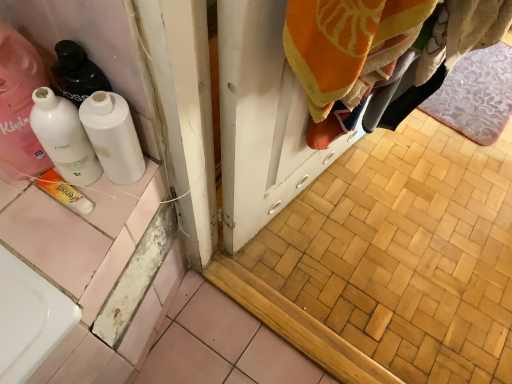
Question: Does yellow matte tube at lower left have a greater height compared to white glossy bottle at left, the first bottle positioned from the left?

Choices:
 (A) yes
 (B) no

Answer: (B)

Question: From a real-world perspective, does yellow matte tube at lower left sit lower than white glossy bottle at left, the first bottle positioned from the left?

Choices:
 (A) no
 (B) yes

Answer: (B)

Question: Considering the relative sizes of yellow matte tube at lower left and white glossy bottle at left, which is the second bottle in right-to-left order, in the image provided, is yellow matte tube at lower left bigger than white glossy bottle at left, which is the second bottle in right-to-left order,?

Choices:
 (A) yes
 (B) no

Answer: (B)

Question: Is the position of yellow matte tube at lower left more distant than that of white glossy bottle at left, which is the second bottle in right-to-left order?

Choices:
 (A) no
 (B) yes

Answer: (B)

Question: Considering the relative sizes of yellow matte tube at lower left and white glossy bottle at left, which is the second bottle in right-to-left order, in the image provided, is yellow matte tube at lower left thinner than white glossy bottle at left, which is the second bottle in right-to-left order,?

Choices:
 (A) no
 (B) yes

Answer: (B)

Question: From the image's perspective, is white glossy bottle at left, placed as the 2th bottle when sorted from left to right, located above or below white glossy bottle at left?

Choices:
 (A) below
 (B) above

Answer: (A)

Question: Relative to white glossy bottle at left, is white glossy bottle at left, the 1th bottle viewed from the right, in front or behind?

Choices:
 (A) behind
 (B) front

Answer: (A)

Question: From a real-world perspective, is white glossy bottle at left, the 1th bottle viewed from the right, physically located above or below white glossy bottle at left?

Choices:
 (A) below
 (B) above

Answer: (A)

Question: Looking at their shapes, would you say white glossy bottle at left, placed as the 2th bottle when sorted from left to right, is wider or thinner than white glossy bottle at left?

Choices:
 (A) wide
 (B) thin

Answer: (B)

Question: Considering the relative positions of yellow matte tube at lower left and white glossy bottle at left in the image provided, is yellow matte tube at lower left to the left or to the right of white glossy bottle at left?

Choices:
 (A) left
 (B) right

Answer: (B)

Question: From a real-world perspective, is yellow matte tube at lower left physically located above or below white glossy bottle at left?

Choices:
 (A) below
 (B) above

Answer: (A)

Question: From the image's perspective, is yellow matte tube at lower left located above or below white glossy bottle at left?

Choices:
 (A) above
 (B) below

Answer: (B)

Question: Is yellow matte tube at lower left inside or outside of white glossy bottle at left?

Choices:
 (A) inside
 (B) outside

Answer: (B)

Question: In the image, is pink floral bath mat at lower right positioned in front of or behind white glossy bottle at left?

Choices:
 (A) front
 (B) behind

Answer: (B)

Question: Is point coord(467,122) closer or farther from the camera than point coord(2,102)?

Choices:
 (A) closer
 (B) farther

Answer: (B)